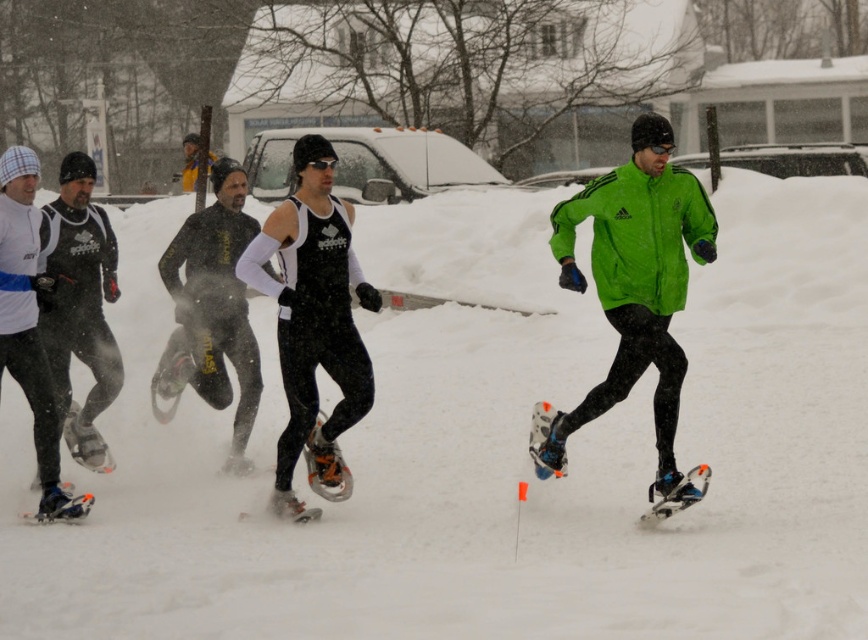
Question: Considering the real-world distances, which object is closest to the white fluffy snow at center?

Choices:
 (A) black matte snowshoes at center
 (B) matte black ski suit at center
 (C) green matte jacket at center
 (D) matte black snowshoes at left

Answer: (A)

Question: Can you confirm if white fluffy snow at center is positioned below matte black snowshoes at left?

Choices:
 (A) no
 (B) yes

Answer: (B)

Question: Does green matte jacket at center appear on the right side of matte black ski suit at center?

Choices:
 (A) no
 (B) yes

Answer: (B)

Question: Does white fluffy snow at center have a larger size compared to green matte jacket at center?

Choices:
 (A) no
 (B) yes

Answer: (B)

Question: Among these points, which one is nearest to the camera?

Choices:
 (A) (51, 262)
 (B) (825, 545)

Answer: (B)

Question: Which object appears closest to the camera in this image?

Choices:
 (A) black matte snowshoes at center
 (B) white fluffy snow at center
 (C) matte black snowshoes at left

Answer: (B)